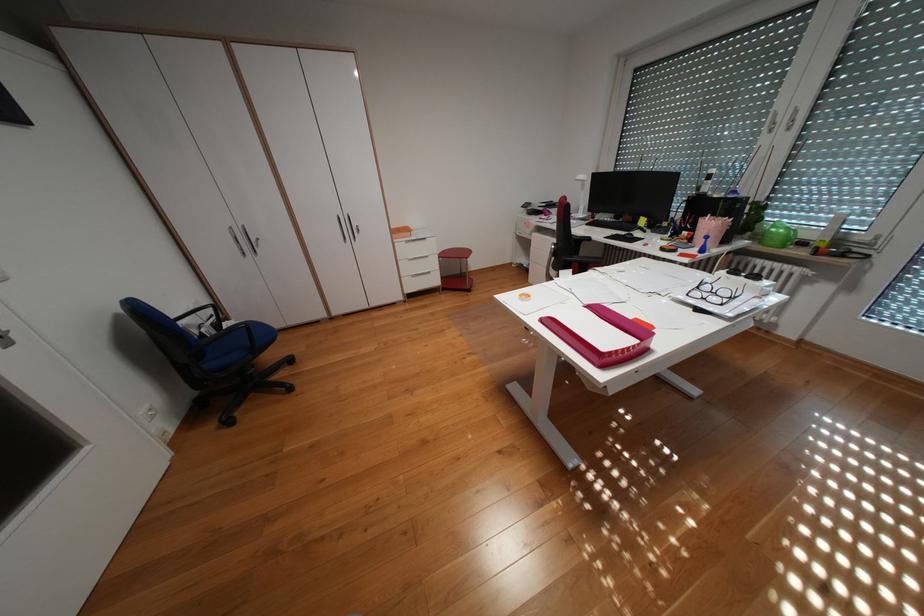
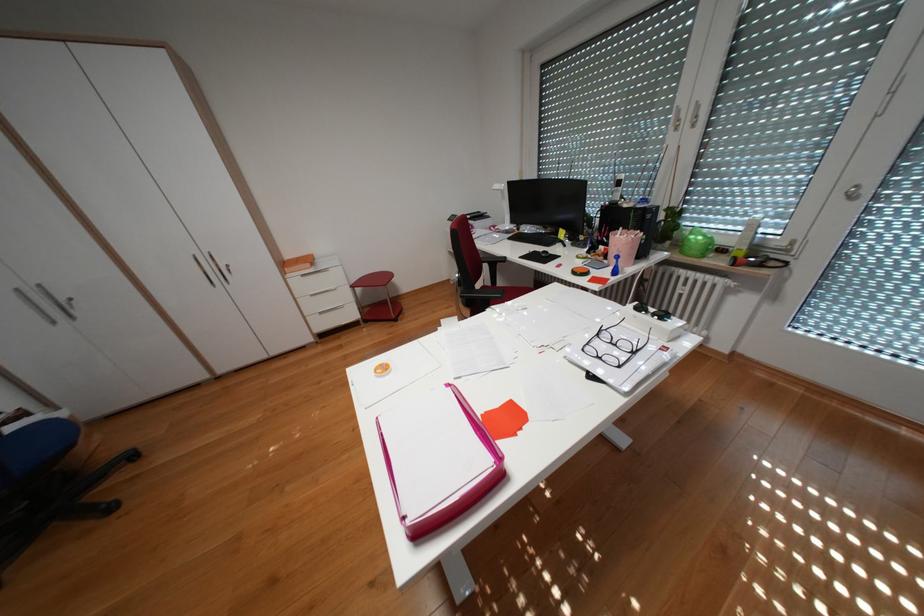
The point at (772, 243) is marked in the first image. Where is the corresponding point in the second image?

(694, 252)